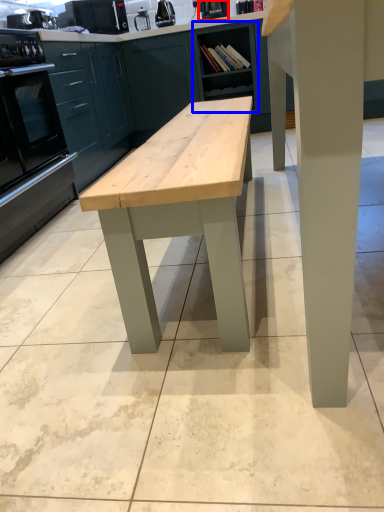
Question: Which object is further to the camera taking this photo, appliance (highlighted by a red box) or cabinetry (highlighted by a blue box)?

Choices:
 (A) appliance
 (B) cabinetry

Answer: (A)